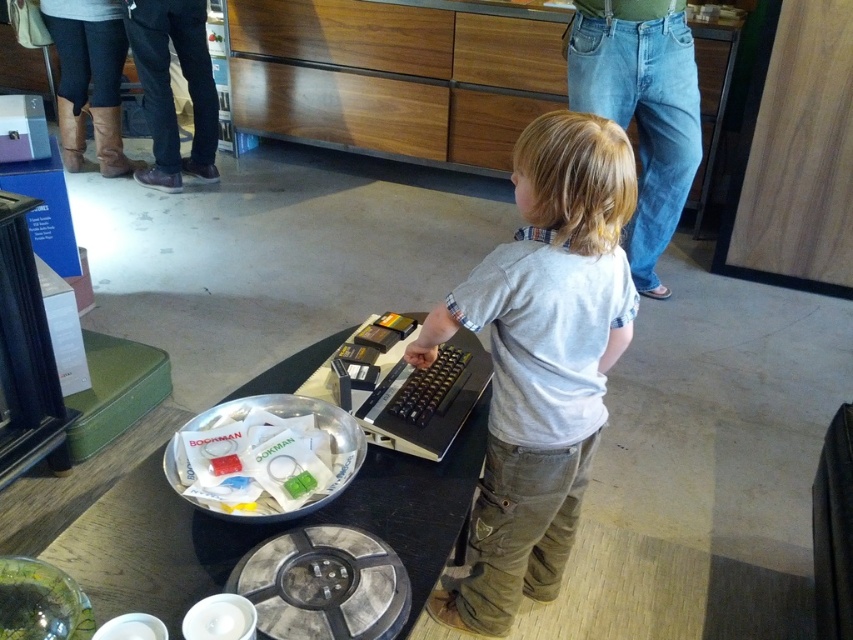
Measure the distance between light gray cotton shirt at center and black glossy table at center.

The distance of light gray cotton shirt at center from black glossy table at center is 12.45 inches.

Based on the photo, can you confirm if light gray cotton shirt at center is smaller than black glossy table at center?

Yes, light gray cotton shirt at center is smaller than black glossy table at center.

Who is more forward, (550, 177) or (59, 561)?

A: Point (59, 561) is more forward.

Where is `light gray cotton shirt at center`? This screenshot has width=853, height=640. light gray cotton shirt at center is located at coordinates (541, 358).

Is light gray cotton shirt at center to the right of white paper at center from the viewer's perspective?

Yes, light gray cotton shirt at center is to the right of white paper at center.

In order to click on light gray cotton shirt at center in this screenshot , I will do `click(541, 358)`.

Does point (576, 428) lie in front of point (221, 426)?

No, (576, 428) is further to viewer.

The height and width of the screenshot is (640, 853). In order to click on light gray cotton shirt at center in this screenshot , I will do `click(541, 358)`.

Does black glossy table at center have a greater height compared to white paper at center?

Correct, black glossy table at center is much taller as white paper at center.

From the picture: Who is higher up, black glossy table at center or white paper at center?

Positioned higher is white paper at center.

I want to click on black glossy table at center, so point(264,529).